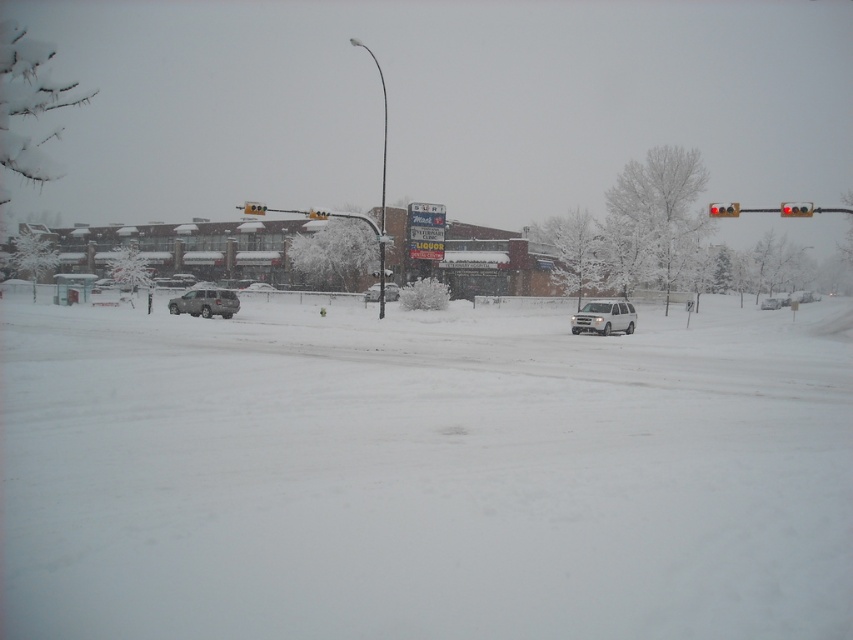
You are a pedestrian standing at the edge of the snowy street. You see the silver metallic suv at center and the green plastic traffic light at upper center. Which object is positioned more to the right side of the scene?

The silver metallic suv at center is positioned more to the right side of the scene than the green plastic traffic light at upper center.

You are a delivery driver who needs to park your car in the parking lot. The parking space is designed to fit vehicles that occupy the same amount of space as the green plastic traffic light at upper center. Can your silver metallic suv at center fit into this parking space?

The silver metallic suv at center occupies less space than the green plastic traffic light at upper center, so yes, the SUV can fit into the parking space designed for the traffic light size.

You are a photographer trying to capture the entire scene in one shot. Given that the green plastic traffic light at upper center and the satin silver suv at center are both in your frame, which object would appear wider in your photo?

The green plastic traffic light at upper center appears wider in the photo because its width is larger than that of the satin silver suv at center.